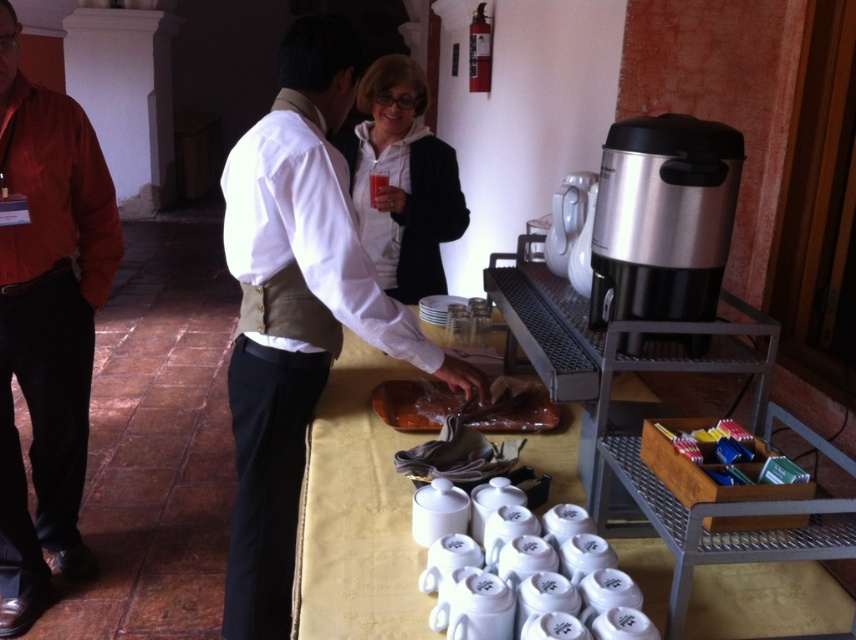
You are standing in the room and want to pick up an object. Which of the two points, point (646,369) or point (379,189), is closer to you?

Point (646,369) is closer to the viewer than point (379,189).

You are organizing a buffet and need to place a new decorative item on the table. The matte orange shirt at left is currently at coordinates point 0.508, 0.055. Where exactly on the table should you place the new item to ensure it doesn not interfere with the existing setup?

The matte orange shirt at left is located at point [46,324]. To avoid interference, place the new item away from this coordinate, ensuring it doesn not overlap or crowd the existing items.

You are standing at the point labeled point (360, 220) and want to walk to the door located at the opposite side of the room. If your walking speed is 3 feet per second, how many seconds will it take you to reach the door?

The distance between you and the door is 8.47 feet. At a speed of 3 feet per second, dividing the distance by speed gives 8.47 divided by 3, which equals approximately 2.82 seconds. So, it will take roughly 2.82 seconds to reach the door.